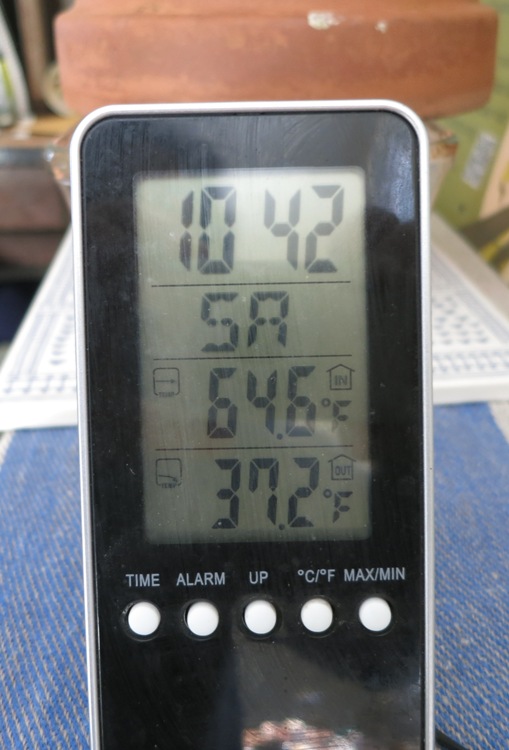
Find the location of a particular element. Image resolution: width=509 pixels, height=750 pixels. floor mats is located at coordinates (466, 501), (469, 346).